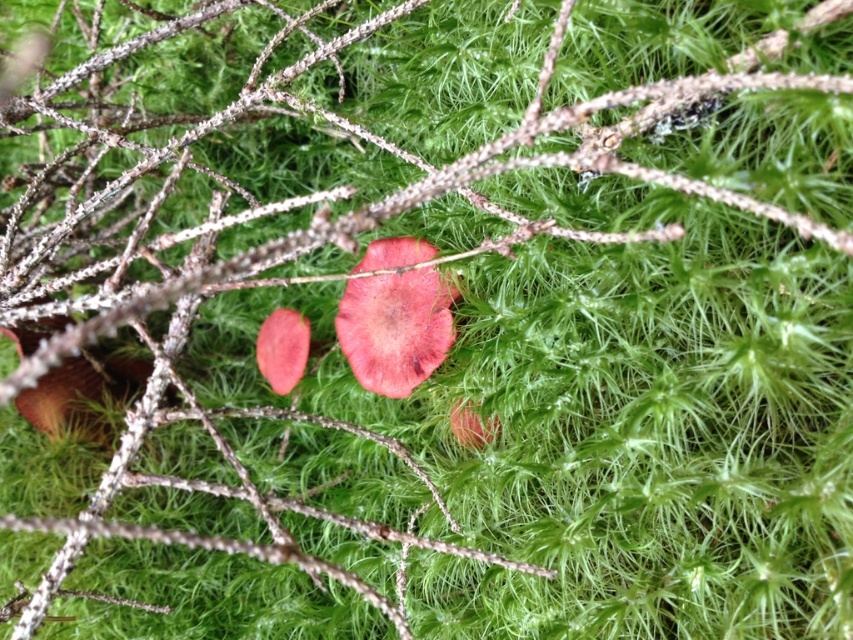
Is glossy red mushroom at center closer to camera compared to matte pink petal at center?

Yes, glossy red mushroom at center is closer to the viewer.

Between glossy red mushroom at center and matte pink petal at center, which one has more height?

With more height is glossy red mushroom at center.

What do you see at coordinates (395, 328) in the screenshot? Image resolution: width=853 pixels, height=640 pixels. I see `glossy red mushroom at center` at bounding box center [395, 328].

Find the location of a particular element. glossy red mushroom at center is located at coordinates (395, 328).

Based on the photo, which is more to the left, matte pink petal at center or glossy pink petal at center?

Positioned to the left is matte pink petal at center.

Does matte pink petal at center appear under glossy pink petal at center?

No.

What do you see at coordinates (283, 348) in the screenshot?
I see `matte pink petal at center` at bounding box center [283, 348].

At what (x,y) coordinates should I click in order to perform the action: click on matte pink petal at center. Please return your answer as a coordinate pair (x, y). Looking at the image, I should click on (283, 348).

Who is more forward, (375, 362) or (496, 426)?

Positioned in front is point (496, 426).

Identify the location of glossy red mushroom at center. (395, 328).

The width and height of the screenshot is (853, 640). What are the coordinates of `glossy red mushroom at center` in the screenshot? It's located at (395, 328).